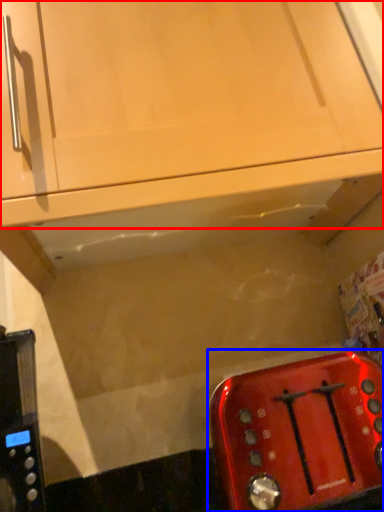
Question: Which of the following is the farthest to the observer, cabinetry (highlighted by a red box) or toaster (highlighted by a blue box)?

Choices:
 (A) cabinetry
 (B) toaster

Answer: (A)